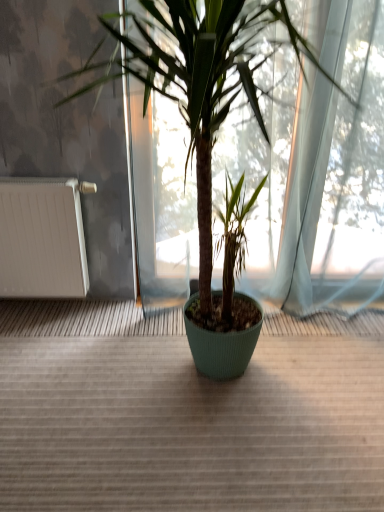
Where is `white matte radiator at left`? white matte radiator at left is located at coordinates (42, 238).

The height and width of the screenshot is (512, 384). Describe the element at coordinates (42, 238) in the screenshot. I see `white matte radiator at left` at that location.

Measure the distance between white matte radiator at left and camera.

They are 6.44 feet apart.

This screenshot has width=384, height=512. I want to click on green ribbed pot at center, so click(x=203, y=118).

Describe the element at coordinates (203, 118) in the screenshot. Image resolution: width=384 pixels, height=512 pixels. I see `green ribbed pot at center` at that location.

The width and height of the screenshot is (384, 512). I want to click on white matte radiator at left, so click(x=42, y=238).

Between white matte radiator at left and green ribbed pot at center, which one appears on the left side from the viewer's perspective?

Positioned to the left is white matte radiator at left.

Which object is further away from the camera taking this photo, white matte radiator at left or green ribbed pot at center?

white matte radiator at left is further from the camera.

Is point (5, 270) closer to viewer compared to point (228, 106)?

No, (5, 270) is behind (228, 106).

From the image's perspective, is white matte radiator at left located above green ribbed pot at center?

No, from the image's perspective, white matte radiator at left is not above green ribbed pot at center.

From a real-world perspective, relative to green ribbed pot at center, is white matte radiator at left vertically above or below?

white matte radiator at left is situated lower than green ribbed pot at center in the real world.

From the picture: In terms of width, does white matte radiator at left look wider or thinner when compared to green ribbed pot at center?

Clearly, white matte radiator at left has less width compared to green ribbed pot at center.

Can you confirm if white matte radiator at left is taller than green ribbed pot at center?

Incorrect, the height of white matte radiator at left is not larger of that of green ribbed pot at center.

Based on their sizes in the image, would you say white matte radiator at left is bigger or smaller than green ribbed pot at center?

Considering their sizes, white matte radiator at left takes up less space than green ribbed pot at center.

Is white matte radiator at left completely or partially outside of green ribbed pot at center?

That's correct, white matte radiator at left is outside of green ribbed pot at center.

Would you say white matte radiator at left is a long distance from green ribbed pot at center?

No, white matte radiator at left is in close proximity to green ribbed pot at center.

Is white matte radiator at left looking in the opposite direction of green ribbed pot at center?

No, green ribbed pot at center is not at the back of white matte radiator at left.

Consider the image. What's the angular difference between white matte radiator at left and green ribbed pot at center's facing directions?

white matte radiator at left and green ribbed pot at center are facing 4.98 degrees away from each other.

Where is `radiator on the left of the green ribbed pot at center`? This screenshot has height=512, width=384. radiator on the left of the green ribbed pot at center is located at coordinates (42, 238).

Which object is positioned more to the left, green ribbed pot at center or white matte radiator at left?

Positioned to the left is white matte radiator at left.

Does green ribbed pot at center lie behind white matte radiator at left?

That is False.

Is point (243, 34) closer or farther from the camera than point (70, 281)?

Clearly, point (243, 34) is closer to the camera than point (70, 281).

From the image's perspective, is green ribbed pot at center above or below white matte radiator at left?

Clearly, from the image's perspective, green ribbed pot at center is above white matte radiator at left.

From a real-world perspective, does green ribbed pot at center sit lower than white matte radiator at left?

No, from a real-world perspective, green ribbed pot at center is not below white matte radiator at left.

In terms of width, does green ribbed pot at center look wider or thinner when compared to white matte radiator at left?

Clearly, green ribbed pot at center has more width compared to white matte radiator at left.

Can you confirm if green ribbed pot at center is shorter than white matte radiator at left?

No.

Based on their sizes in the image, would you say green ribbed pot at center is bigger or smaller than white matte radiator at left?

Clearly, green ribbed pot at center is larger in size than white matte radiator at left.

Is green ribbed pot at center surrounding white matte radiator at left?

Actually, white matte radiator at left is outside green ribbed pot at center.

Is green ribbed pot at center far from white matte radiator at left?

They are positioned close to each other.

Does green ribbed pot at center turn towards white matte radiator at left?

No, green ribbed pot at center is not oriented towards white matte radiator at left.

This screenshot has height=512, width=384. Find the location of `houseplant in front of the white matte radiator at left`. houseplant in front of the white matte radiator at left is located at coordinates (203, 118).

At what (x,y) coordinates should I click in order to perform the action: click on radiator below the green ribbed pot at center (from a real-world perspective). Please return your answer as a coordinate pair (x, y). This screenshot has height=512, width=384. Looking at the image, I should click on (42, 238).

At what (x,y) coordinates should I click in order to perform the action: click on houseplant lying above the white matte radiator at left (from the image's perspective). Please return your answer as a coordinate pair (x, y). The height and width of the screenshot is (512, 384). Looking at the image, I should click on (203, 118).